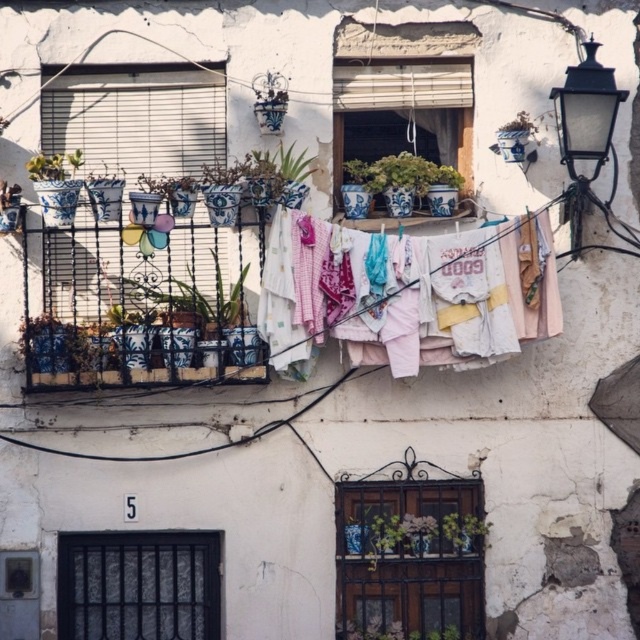
Question: Which point is closer to the camera?

Choices:
 (A) green ceramic pot at upper right
 (B) black metal bars at lower left
 (C) decorative wrought iron at center

Answer: (C)

Question: Does black metal streetlamp at upper right have a greater width compared to green glossy plant at lower center?

Choices:
 (A) no
 (B) yes

Answer: (B)

Question: Among these objects, which one is farthest from the camera?

Choices:
 (A) matte white window at upper center
 (B) green glossy plant at lower center
 (C) blue and white ceramic pots at left

Answer: (A)

Question: Does white cotton clothes at center appear on the right side of black metal streetlamp at upper right?

Choices:
 (A) no
 (B) yes

Answer: (A)

Question: Among these objects, which one is farthest from the camera?

Choices:
 (A) matte white window at upper center
 (B) green glossy plant at lower center
 (C) decorative wrought iron at center
 (D) black metal bars at lower left

Answer: (A)

Question: Where is black metal streetlamp at upper right located in relation to blue and white ceramic pot at center in the image?

Choices:
 (A) left
 (B) right

Answer: (B)